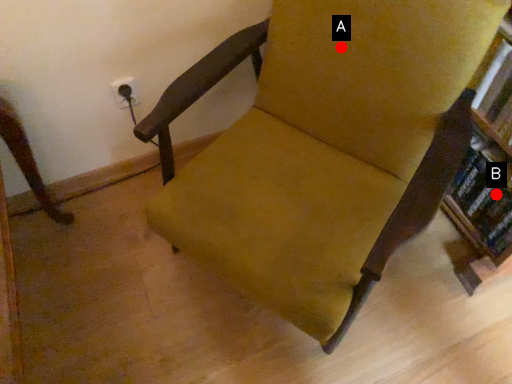
Question: Two points are circled on the image, labeled by A and B beside each circle. Which point is closer to the camera?

Choices:
 (A) A is closer
 (B) B is closer

Answer: (A)